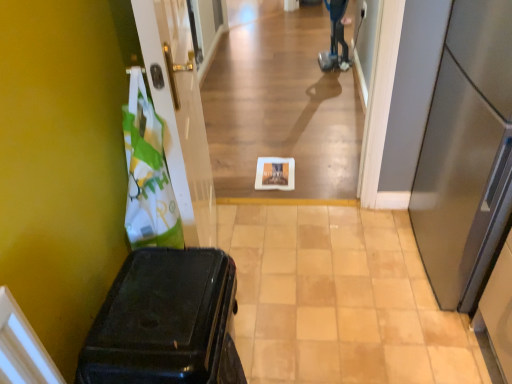
Find the location of a particular element. Image resolution: width=512 pixels, height=384 pixels. unoccupied space behind white paper at center is located at coordinates (286, 160).